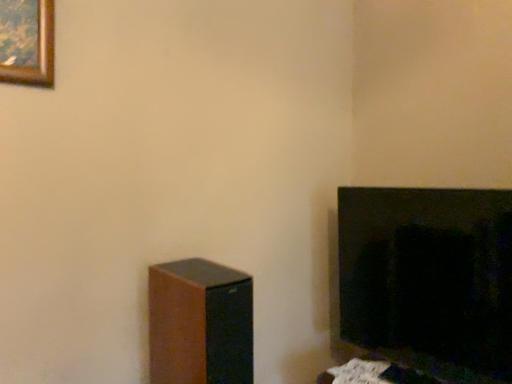
Identify the location of black glossy monitor at right. (429, 278).

Based on the photo, measure the distance between point [483,296] and camera.

Point [483,296] and camera are 4.37 feet apart.

What do you see at coordinates (429, 278) in the screenshot? This screenshot has height=384, width=512. I see `black glossy monitor at right` at bounding box center [429, 278].

You are a GUI agent. You are given a task and a screenshot of the screen. Output one action in this format:
    pyautogui.click(x=<x>, y=<y>)
    Task: Click on the black glossy monitor at right
    This screenshot has width=512, height=384.
    Given the screenshot: What is the action you would take?
    [429, 278]